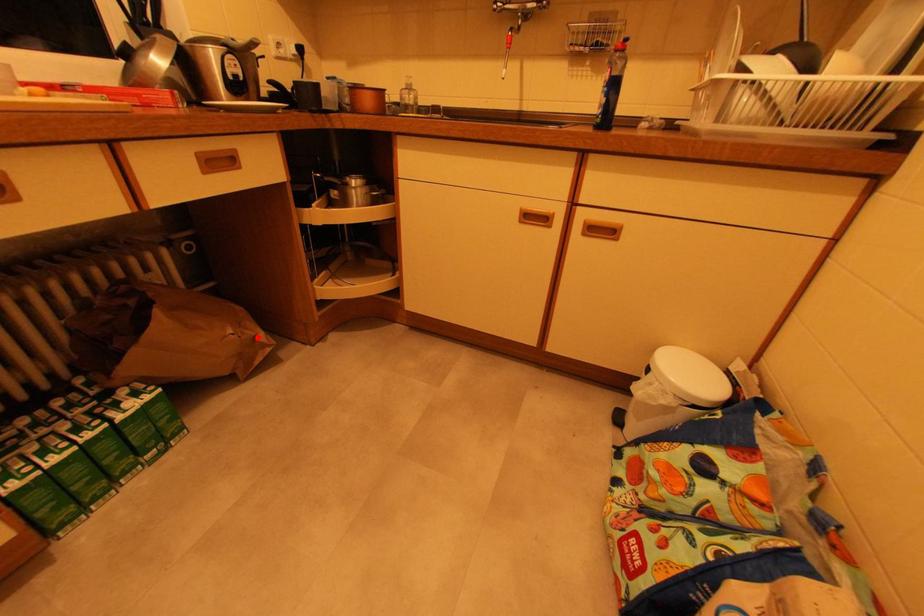
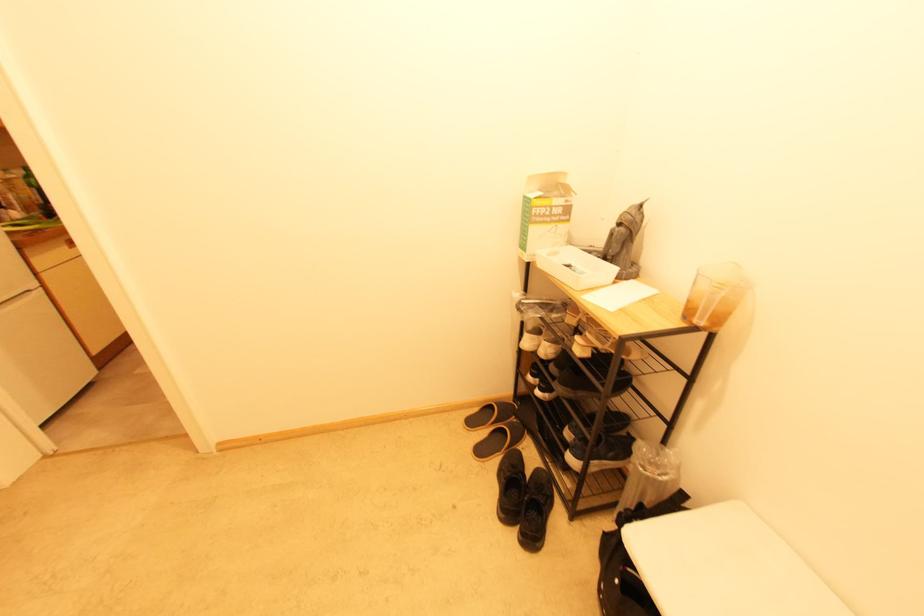
Question: I am providing you with two images of the same scene from different viewpoints. A red point is marked on the first image. Is the red point's position out of view in image 2?

Choices:
 (A) Yes
 (B) No

Answer: (A)